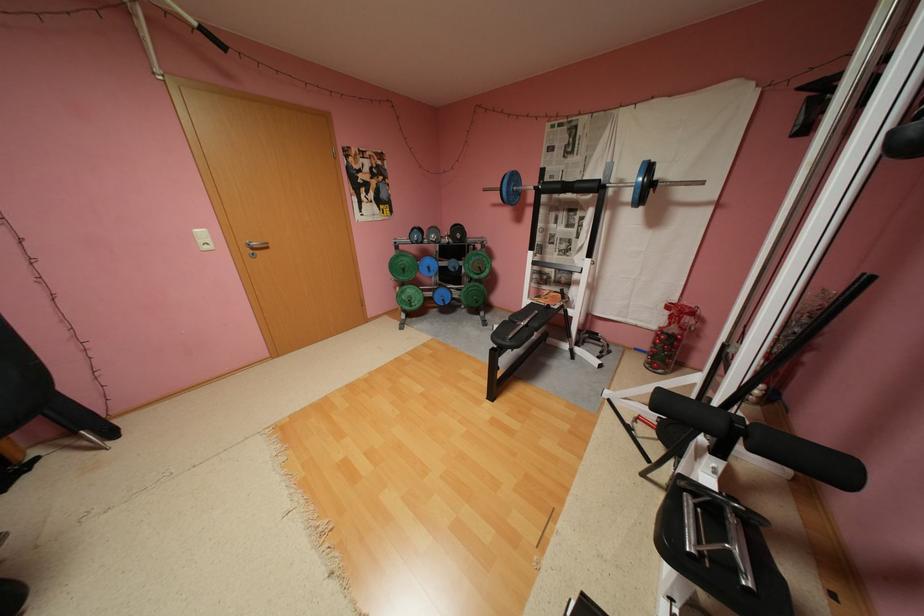
This screenshot has height=616, width=924. What do you see at coordinates (256, 246) in the screenshot?
I see `the silver door handle` at bounding box center [256, 246].